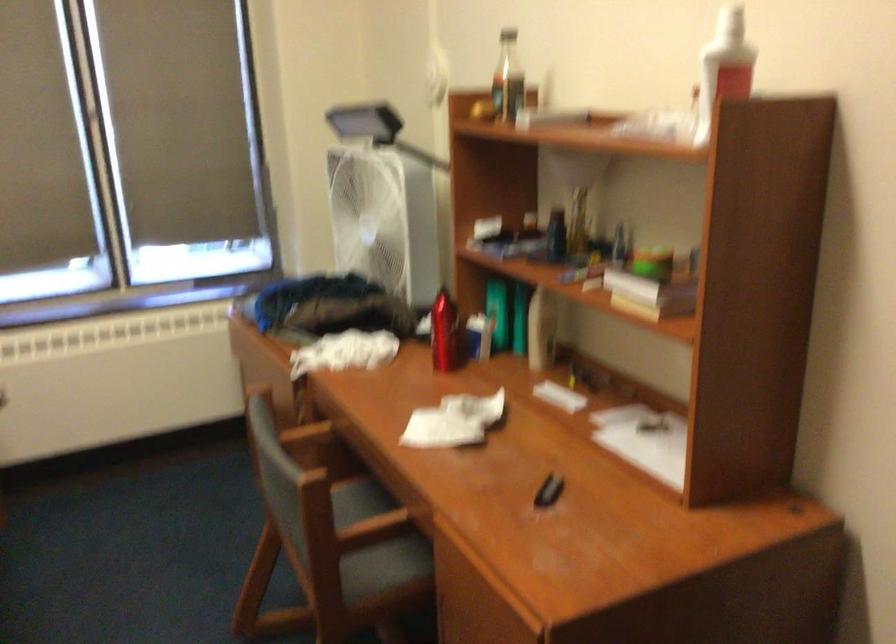
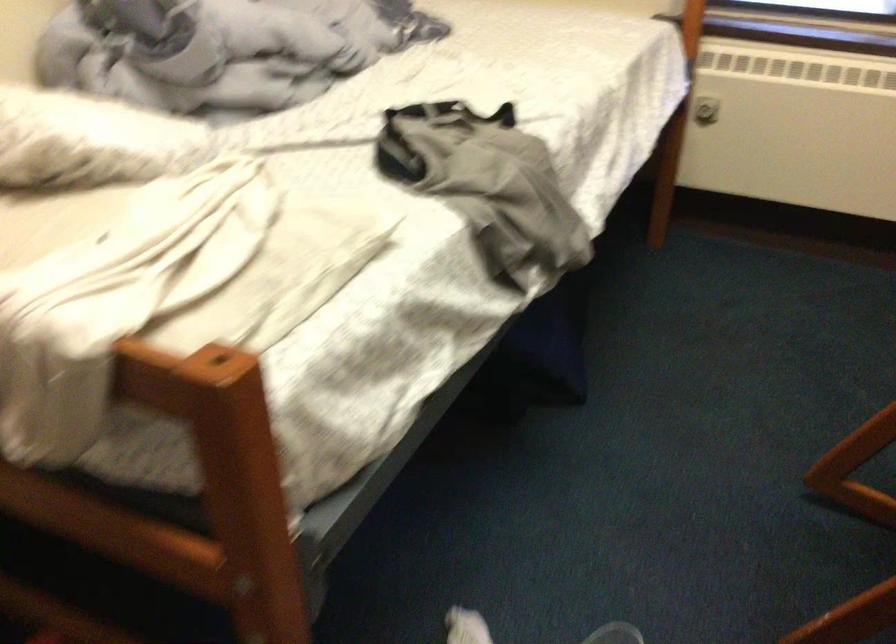
Based on the continuous images, in which direction is the camera rotating?

The camera's rotation is toward left-down.